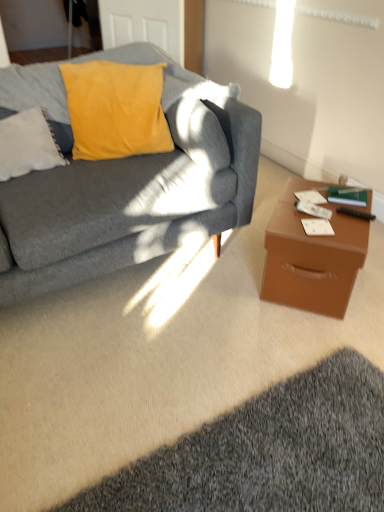
Question: Is black plastic remote control at right thinner than brown leather desk at right?

Choices:
 (A) yes
 (B) no

Answer: (A)

Question: Considering the relative positions of black plastic remote control at right and brown leather desk at right in the image provided, is black plastic remote control at right to the right of brown leather desk at right from the viewer's perspective?

Choices:
 (A) yes
 (B) no

Answer: (A)

Question: Is black plastic remote control at right facing towards brown leather desk at right?

Choices:
 (A) yes
 (B) no

Answer: (B)

Question: Does black plastic remote control at right have a greater width compared to brown leather desk at right?

Choices:
 (A) yes
 (B) no

Answer: (B)

Question: Considering the relative sizes of black plastic remote control at right and brown leather desk at right in the image provided, is black plastic remote control at right bigger than brown leather desk at right?

Choices:
 (A) yes
 (B) no

Answer: (B)

Question: Is point (129, 223) closer or farther from the camera than point (21, 136)?

Choices:
 (A) closer
 (B) farther

Answer: (A)

Question: From a real-world perspective, is matte gray couch at left positioned above or below white fluffy pillow at upper left?

Choices:
 (A) below
 (B) above

Answer: (A)

Question: Relative to white fluffy pillow at upper left, is matte gray couch at left in front or behind?

Choices:
 (A) front
 (B) behind

Answer: (A)

Question: From the image's perspective, is matte gray couch at left located above or below white fluffy pillow at upper left?

Choices:
 (A) below
 (B) above

Answer: (B)

Question: Which is correct: dark gray shaggy rug at lower right is inside black plastic remote control at right, or outside of it?

Choices:
 (A) outside
 (B) inside

Answer: (A)

Question: Considering the positions of point (147, 464) and point (347, 211), is point (147, 464) closer or farther from the camera than point (347, 211)?

Choices:
 (A) closer
 (B) farther

Answer: (A)

Question: Relative to black plastic remote control at right, is dark gray shaggy rug at lower right in front or behind?

Choices:
 (A) front
 (B) behind

Answer: (A)

Question: Considering the positions of dark gray shaggy rug at lower right and black plastic remote control at right in the image, is dark gray shaggy rug at lower right taller or shorter than black plastic remote control at right?

Choices:
 (A) tall
 (B) short

Answer: (A)

Question: Is black plastic remote control at right spatially inside green matte book at right, or outside of it?

Choices:
 (A) outside
 (B) inside

Answer: (A)

Question: In terms of width, does black plastic remote control at right look wider or thinner when compared to green matte book at right?

Choices:
 (A) wide
 (B) thin

Answer: (B)